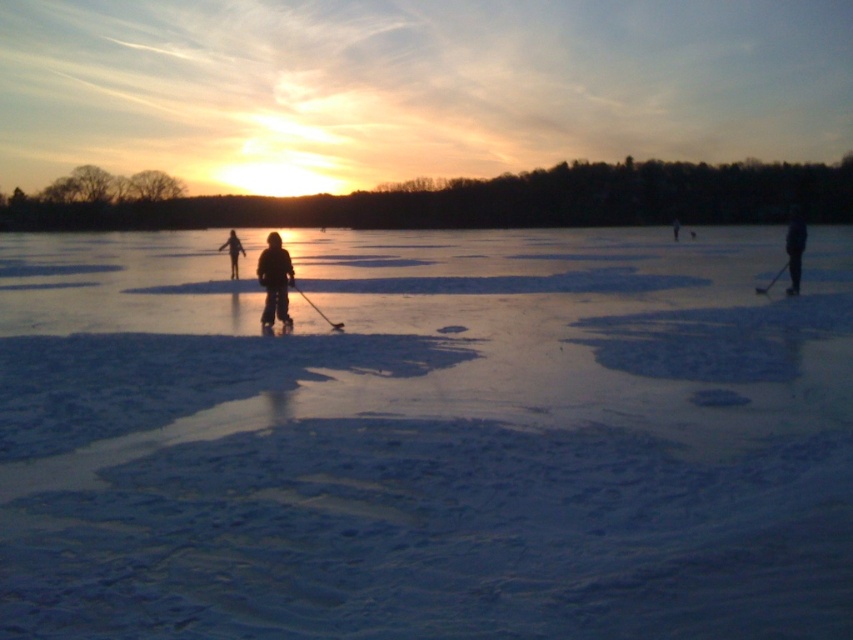
You are standing on the frozen lake and see the white matte ice at center and the dark blue jacket at right in the scene. Which object is closer to the ground?

The white matte ice at center is closer to the ground because it is positioned below the dark blue jacket at right.

You are standing on the frozen lake and see two points marked on the ice. One is at point (268, 312) and the other is at point (328, 320). Which point is closer to you?

Point (268, 312) is closer to the viewer than point (328, 320).